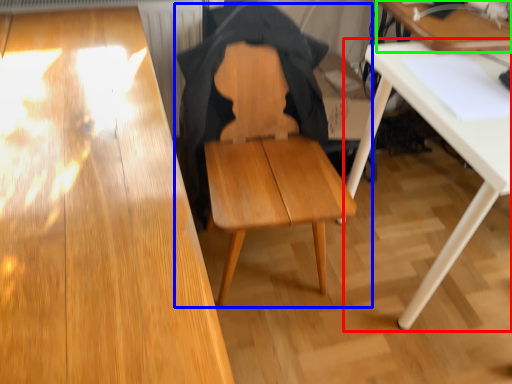
Question: Considering the real-world distances, which object is closest to table (highlighted by a red box)? chair (highlighted by a blue box) or table (highlighted by a green box).

Choices:
 (A) chair
 (B) table

Answer: (B)